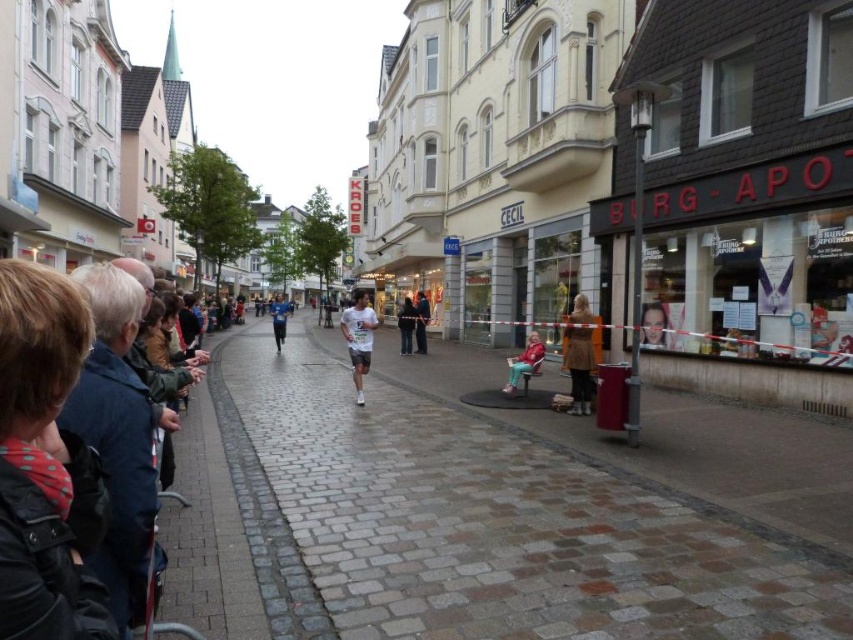
Does point (27, 612) lie behind point (399, 324)?

No.

At what (x,y) coordinates should I click in order to perform the action: click on dark blue jacket at left. Please return your answer as a coordinate pair (x, y). The image size is (853, 640). Looking at the image, I should click on (82, 396).

The width and height of the screenshot is (853, 640). What are the coordinates of `dark blue jacket at left` in the screenshot? It's located at (82, 396).

Does brown cobblestone pavement at center appear on the right side of white matte running shirt at center?

Correct, you'll find brown cobblestone pavement at center to the right of white matte running shirt at center.

Is brown cobblestone pavement at center to the left of white matte running shirt at center from the viewer's perspective?

No, brown cobblestone pavement at center is not to the left of white matte running shirt at center.

Is point (718, 593) positioned behind point (346, 317)?

That is False.

At what (x,y) coordinates should I click in order to perform the action: click on brown cobblestone pavement at center. Please return your answer as a coordinate pair (x, y). The width and height of the screenshot is (853, 640). Looking at the image, I should click on (483, 524).

Which of these two, matte brown storefront at right or blue fabric shirt at center, stands taller?

Standing taller between the two is blue fabric shirt at center.

Is matte brown storefront at right taller than blue fabric shirt at center?

Incorrect, matte brown storefront at right's height is not larger of blue fabric shirt at center's.

Is point (735, 192) positioned in front of point (283, 316)?

Yes, it is.

Identify the location of matte brown storefront at right. This screenshot has height=640, width=853. pyautogui.click(x=755, y=282).